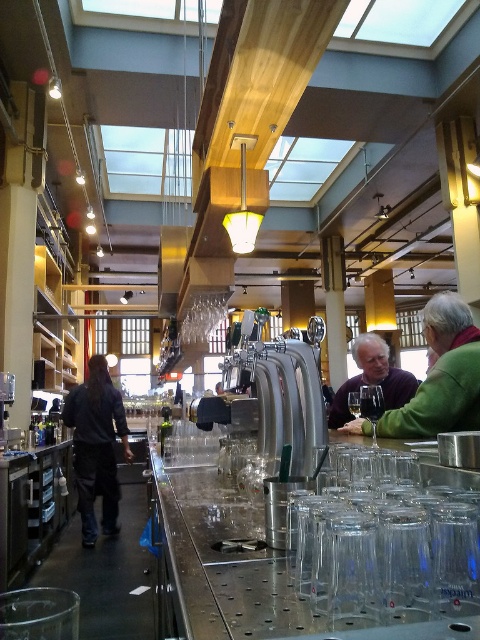
Question: Can you confirm if dark gray jacket at left is wider than clear glass wine glass at center?

Choices:
 (A) no
 (B) yes

Answer: (B)

Question: Among these points, which one is nearest to the camera?

Choices:
 (A) (360, 410)
 (B) (85, 500)
 (C) (375, 444)

Answer: (C)

Question: Can you confirm if dark gray jacket at left is smaller than clear glass wine glass at center?

Choices:
 (A) yes
 (B) no

Answer: (B)

Question: Which point appears closest to the camera in this image?

Choices:
 (A) (79, 404)
 (B) (363, 385)

Answer: (B)

Question: Which point appears farthest from the camera in this image?

Choices:
 (A) (440, 301)
 (B) (339, 426)

Answer: (B)

Question: Is green fabric jacket at right to the left of dark gray jacket at left from the viewer's perspective?

Choices:
 (A) no
 (B) yes

Answer: (A)